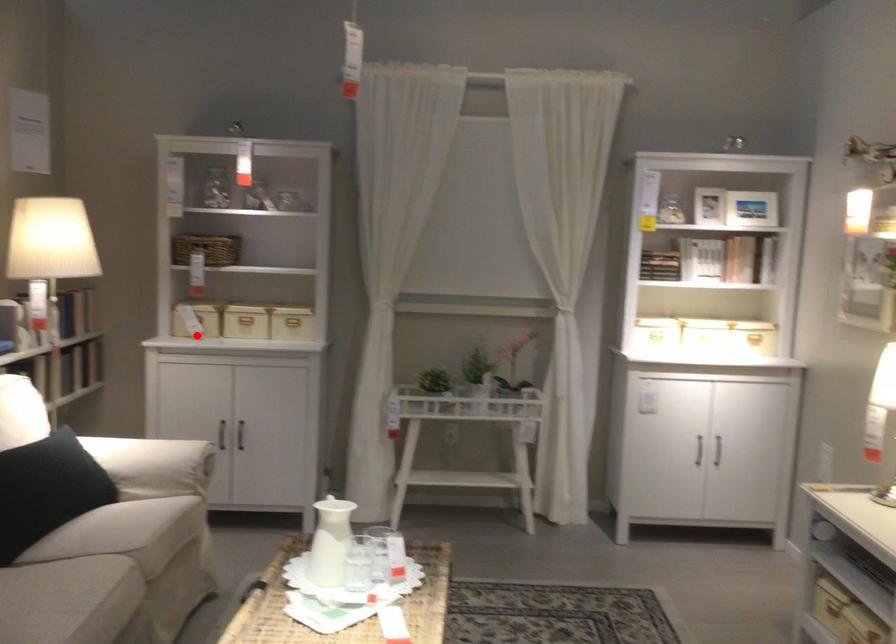
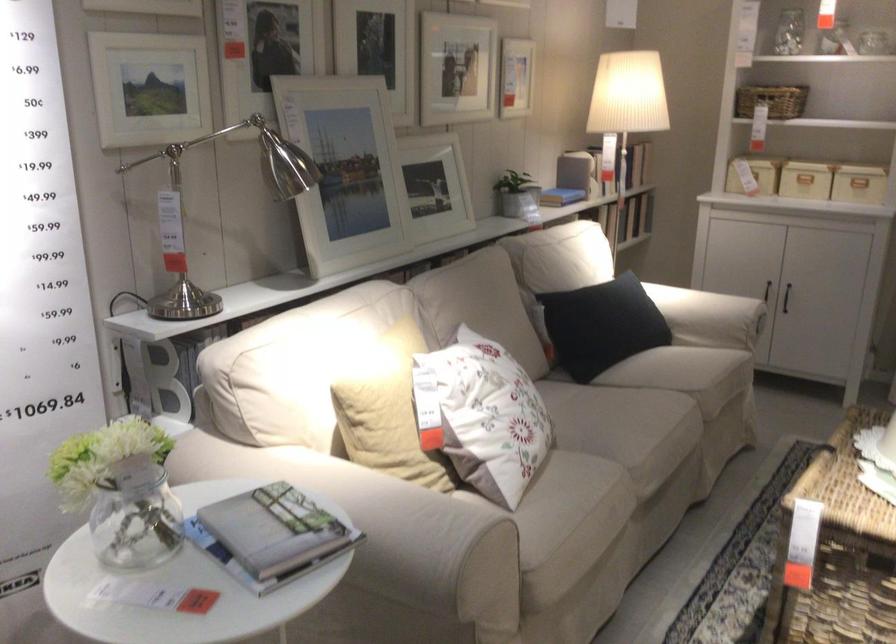
The point at the highlighted location is marked in the first image. Where is the corresponding point in the second image?

(753, 175)